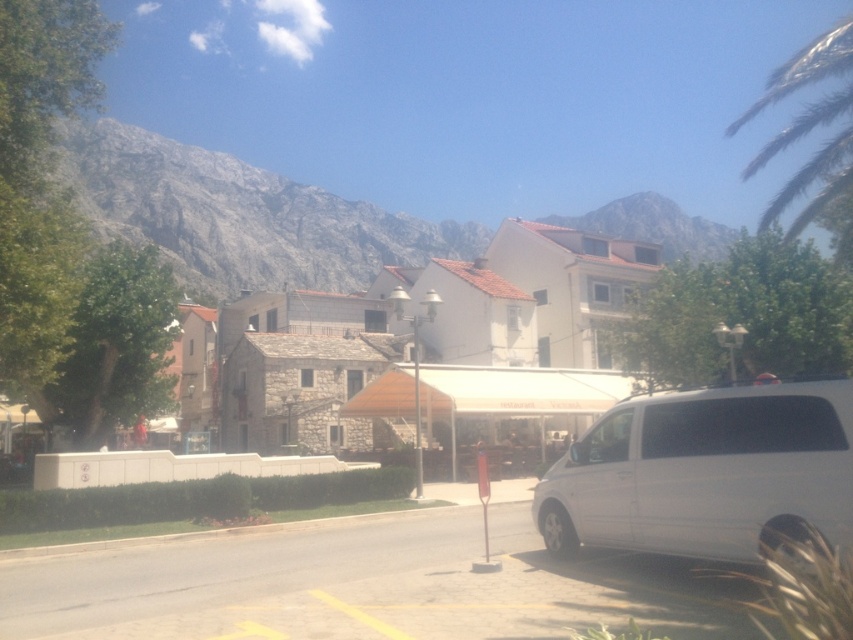
Is the position of white matte minivan at lower right less distant than that of gray rock mountain at upper left?

Yes, white matte minivan at lower right is closer to the viewer.

Can you confirm if white matte minivan at lower right is wider than gray rock mountain at upper left?

No, white matte minivan at lower right is not wider than gray rock mountain at upper left.

The image size is (853, 640). In order to click on white matte minivan at lower right in this screenshot , I will do `click(706, 474)`.

The height and width of the screenshot is (640, 853). Identify the location of white matte minivan at lower right. (706, 474).

Find the location of a particular element. The width and height of the screenshot is (853, 640). white matte minivan at lower right is located at coordinates (706, 474).

Can you confirm if white matte minivan at lower right is thinner than green leafy palm tree at upper right?

Correct, white matte minivan at lower right's width is less than green leafy palm tree at upper right's.

Locate an element on the screen. white matte minivan at lower right is located at coordinates (706, 474).

Which is more to the left, gray rock mountain at upper left or green leafy palm tree at upper right?

gray rock mountain at upper left is more to the left.

Is gray rock mountain at upper left below green leafy palm tree at upper right?

Indeed, gray rock mountain at upper left is positioned under green leafy palm tree at upper right.

Describe the element at coordinates (241, 216) in the screenshot. This screenshot has height=640, width=853. I see `gray rock mountain at upper left` at that location.

Identify the location of gray rock mountain at upper left. (241, 216).